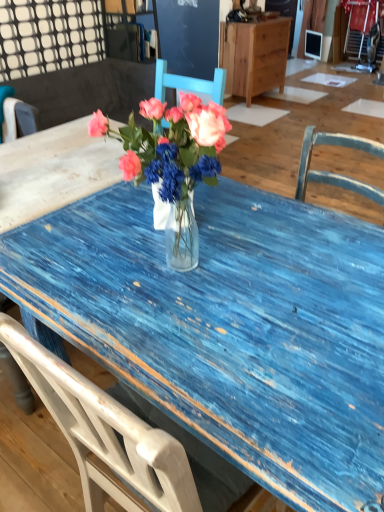
Question: From a real-world perspective, is blue wooden chair at upper left, acting as the first chair starting from the right, over wooden cabinet at upper center?

Choices:
 (A) no
 (B) yes

Answer: (B)

Question: Can you confirm if blue wooden chair at upper left, acting as the first chair starting from the right, is smaller than wooden cabinet at upper center?

Choices:
 (A) yes
 (B) no

Answer: (B)

Question: Does blue wooden chair at upper left, acting as the first chair starting from the right, have a larger size compared to wooden cabinet at upper center?

Choices:
 (A) no
 (B) yes

Answer: (B)

Question: From the image's perspective, does blue wooden chair at upper left, which is the second chair in left-to-right order, appear lower than wooden cabinet at upper center?

Choices:
 (A) yes
 (B) no

Answer: (A)

Question: Considering the positions of blue wooden chair at upper left, acting as the first chair starting from the right, and wooden cabinet at upper center in the image, is blue wooden chair at upper left, acting as the first chair starting from the right, taller or shorter than wooden cabinet at upper center?

Choices:
 (A) tall
 (B) short

Answer: (B)

Question: Relative to wooden cabinet at upper center, is blue wooden chair at upper left, which is the second chair in left-to-right order, in front or behind?

Choices:
 (A) front
 (B) behind

Answer: (A)

Question: Considering the positions of blue wooden chair at upper left, which is the second chair in left-to-right order, and wooden cabinet at upper center in the image, is blue wooden chair at upper left, which is the second chair in left-to-right order, wider or thinner than wooden cabinet at upper center?

Choices:
 (A) wide
 (B) thin

Answer: (A)

Question: Considering the positions of blue wooden chair at upper left, which is the second chair in left-to-right order, and wooden cabinet at upper center in the image, is blue wooden chair at upper left, which is the second chair in left-to-right order, bigger or smaller than wooden cabinet at upper center?

Choices:
 (A) small
 (B) big

Answer: (B)

Question: Is point (24, 111) positioned closer to the camera than point (248, 27)?

Choices:
 (A) closer
 (B) farther

Answer: (A)

Question: Is white wood chair at left, which is the 2th chair from right to left, in front of or behind wooden cabinet at upper center in the image?

Choices:
 (A) front
 (B) behind

Answer: (A)

Question: From a real-world perspective, is white wood chair at left, placed as the 1th chair when sorted from left to right, above or below wooden cabinet at upper center?

Choices:
 (A) below
 (B) above

Answer: (B)

Question: In terms of size, does white wood chair at left, which is the 2th chair from right to left, appear bigger or smaller than wooden cabinet at upper center?

Choices:
 (A) big
 (B) small

Answer: (B)

Question: Considering their positions, is wooden cabinet at upper center located in front of or behind matte glass vase at center?

Choices:
 (A) front
 (B) behind

Answer: (B)

Question: Is wooden cabinet at upper center inside the boundaries of matte glass vase at center, or outside?

Choices:
 (A) outside
 (B) inside

Answer: (A)